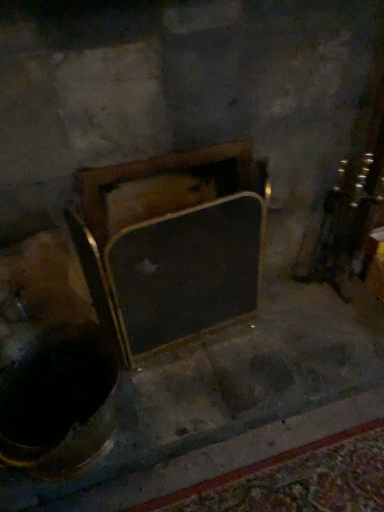
The width and height of the screenshot is (384, 512). I want to click on metallic gold frame at center, so click(x=170, y=244).

In order to face metallic gold frame at center, should I rotate leftwards or rightwards?

You should look left and rotate roughly 0.421 degrees.

What do you see at coordinates (170, 244) in the screenshot?
I see `metallic gold frame at center` at bounding box center [170, 244].

Where is `metallic gold frame at center`? metallic gold frame at center is located at coordinates (170, 244).